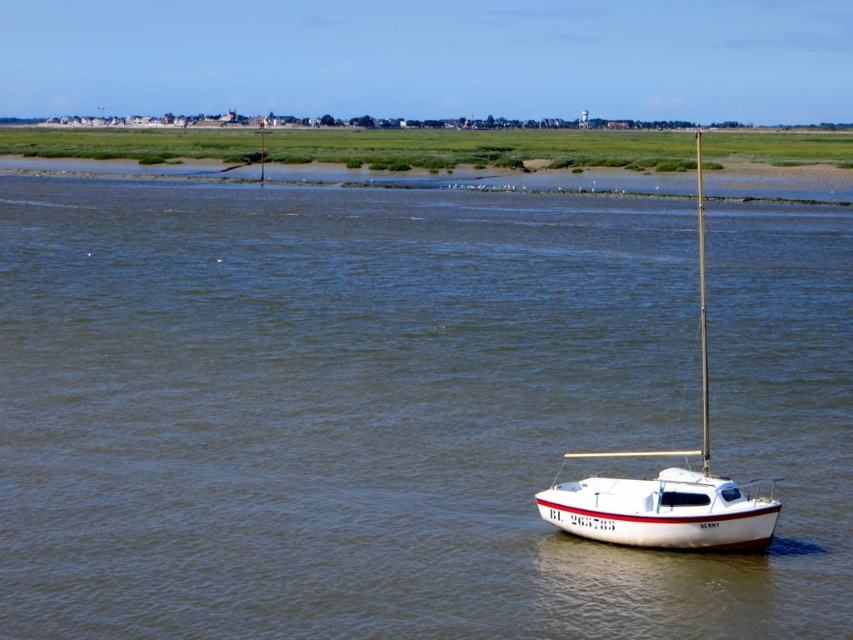
You are a marine biologist observing the coastal scene. You notice the brown water at center and the white glossy sailboat at center. Which object is located below the other?

The brown water at center is positioned under the white glossy sailboat at center, meaning the water is below the boat.

You are a photographer planning to capture the brown water at center and the white glossy sailboat at center in a single shot. Based on their heights, which object will appear closer to the bottom of the photo?

The brown water at center has a lesser height compared to the white glossy sailboat at center, so it will appear closer to the bottom of the photo.